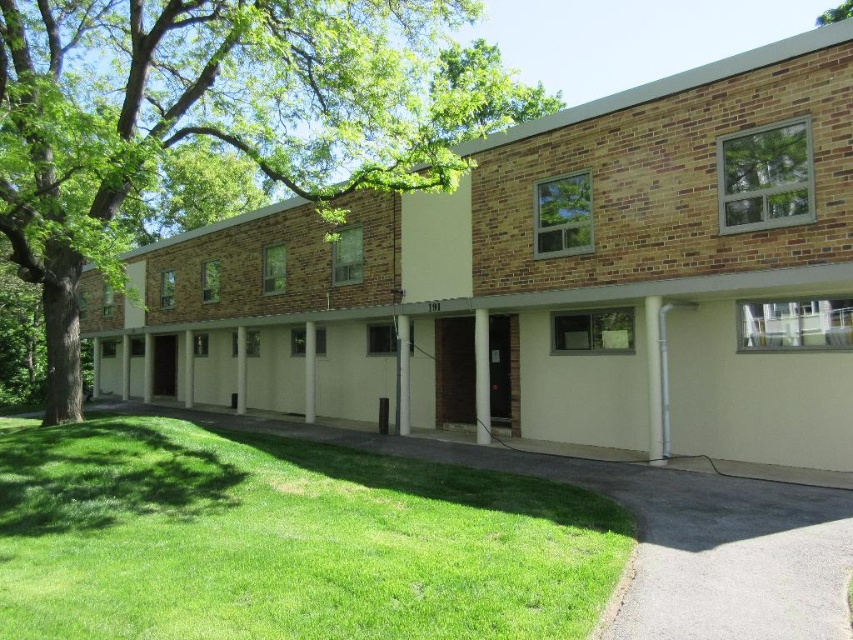
Question: Does green grass at lower left lie in front of green leafy tree at upper left?

Choices:
 (A) yes
 (B) no

Answer: (A)

Question: Is green grass at lower left bigger than green leafy tree at upper right?

Choices:
 (A) no
 (B) yes

Answer: (A)

Question: Which object is positioned closest to the green leafy tree at upper right?

Choices:
 (A) green leafy tree at upper left
 (B) green grass at lower left

Answer: (A)

Question: Does green grass at lower left have a greater width compared to green leafy tree at upper right?

Choices:
 (A) no
 (B) yes

Answer: (A)

Question: Estimate the real-world distances between objects in this image. Which object is closer to the green leafy tree at upper right?

Choices:
 (A) green leafy tree at upper left
 (B) green grass at lower left

Answer: (A)

Question: Which object appears farthest from the camera in this image?

Choices:
 (A) green grass at lower left
 (B) green leafy tree at upper right

Answer: (B)